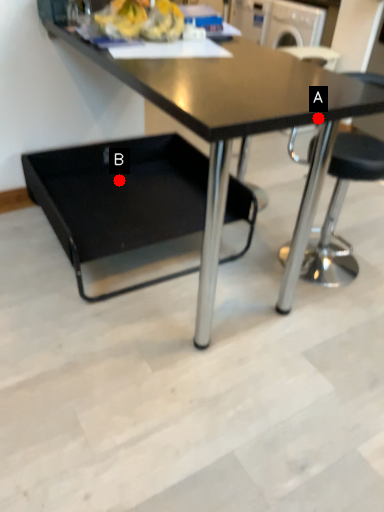
Question: Two points are circled on the image, labeled by A and B beside each circle. Which point appears farthest from the camera in this image?

Choices:
 (A) A is further
 (B) B is further

Answer: (B)